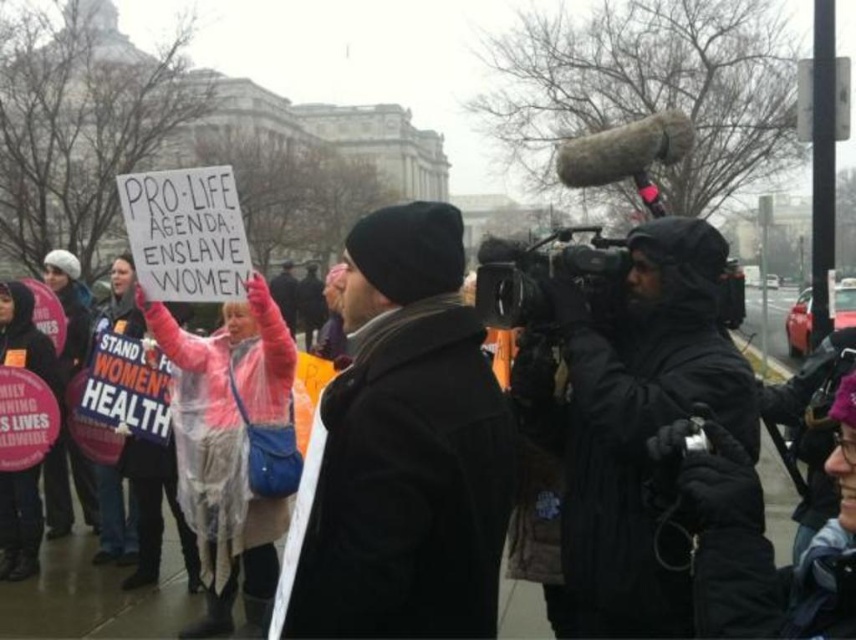
Based on the photo, you are a photographer at the demonstration. You need to capture a photo that includes both the black woolen hat at center and the pink waterproof jacket at center. Which object should you focus on first to ensure both are in frame?

The black woolen hat at center is located above the pink waterproof jacket at center, so you should focus on the pink waterproof jacket at center first to ensure both are in frame.

You are a photographer trying to capture a photo of the black woolen hat at center and the pink waterproof jacket at center for a news article. Your camera has a maximum focus range of 2 meters. Can you take a clear photo of both objects without moving your position?

The black woolen hat at center is 2.18 meters from the pink waterproof jacket at center. Since the distance between them exceeds the camera maximum focus range of 2 meters, you cannot take a clear photo of both objects without moving your position.

What is the exact 2D coordinate of the black woolen hat at center?

The black woolen hat at center is located at the 2D coordinate point of (402, 451).